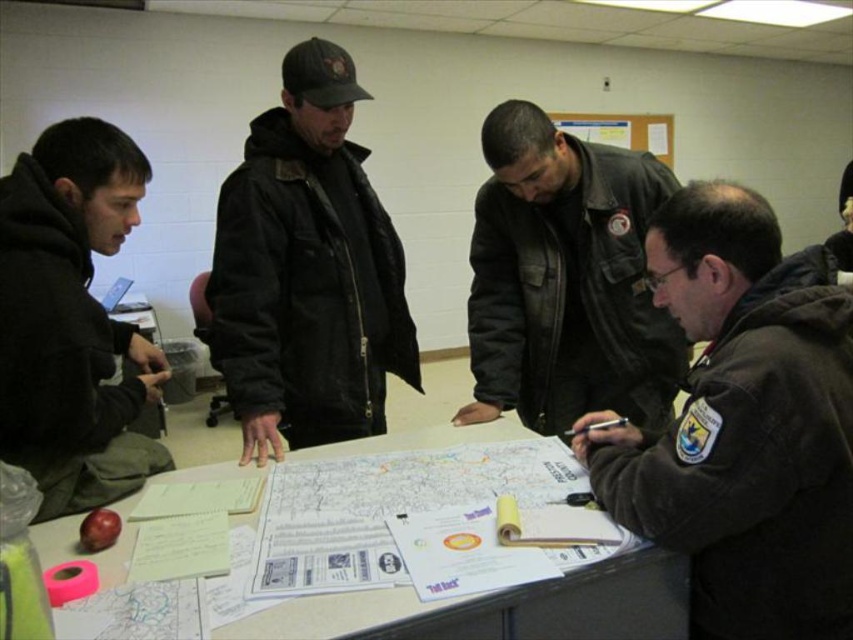
Can you confirm if black fleece hoodie at left is shorter than white paper at center?

In fact, black fleece hoodie at left may be taller than white paper at center.

Between black fleece hoodie at left and white paper at center, which one appears on the left side from the viewer's perspective?

From the viewer's perspective, black fleece hoodie at left appears more on the left side.

The width and height of the screenshot is (853, 640). What are the coordinates of `black fleece hoodie at left` in the screenshot? It's located at (73, 321).

Does dark brown leather jacket at lower right appear under matte black jacket at center?

Yes.

Can you confirm if dark brown leather jacket at lower right is positioned above matte black jacket at center?

Incorrect, dark brown leather jacket at lower right is not positioned above matte black jacket at center.

Locate an element on the screen. This screenshot has height=640, width=853. dark brown leather jacket at lower right is located at coordinates (746, 426).

Does dark brown leather jacket at lower right have a lesser height compared to leather jacket at center?

Indeed, dark brown leather jacket at lower right has a lesser height compared to leather jacket at center.

Is point (813, 404) positioned in front of point (659, 324)?

Yes, it is.

Where is `dark brown leather jacket at lower right`? This screenshot has width=853, height=640. dark brown leather jacket at lower right is located at coordinates (746, 426).